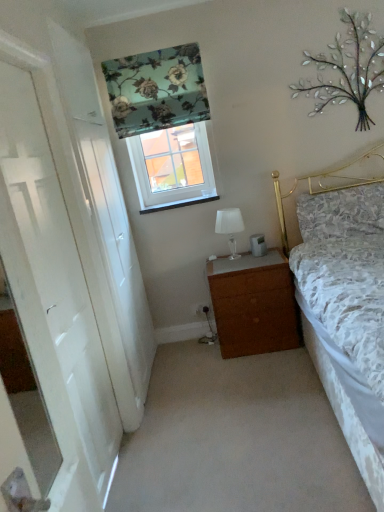
Question: Considering the positions of white glass table lamp at center and white glossy door at left in the image, is white glass table lamp at center taller or shorter than white glossy door at left?

Choices:
 (A) tall
 (B) short

Answer: (B)

Question: Considering the positions of point (221, 222) and point (26, 316), is point (221, 222) closer or farther from the camera than point (26, 316)?

Choices:
 (A) closer
 (B) farther

Answer: (B)

Question: Which object is positioned closest to the floral fabric pillow at upper right?

Choices:
 (A) metallic silver tree at upper right
 (B) floral fabric curtain at upper center
 (C) white glossy door at left
 (D) white plastic window at upper center
 (E) brown wood chest of drawers at center

Answer: (E)

Question: Based on their relative distances, which object is nearer to the brown wood chest of drawers at center?

Choices:
 (A) white glossy door at left
 (B) floral fabric pillow at upper right
 (C) metallic silver tree at upper right
 (D) white plastic window at upper center
 (E) white glass table lamp at center

Answer: (E)